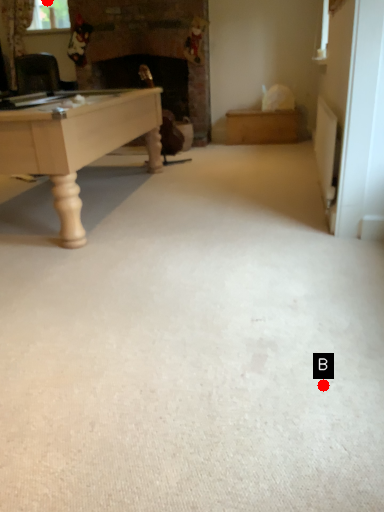
Question: Two points are circled on the image, labeled by A and B beside each circle. Which point is closer to the camera?

Choices:
 (A) A is closer
 (B) B is closer

Answer: (B)